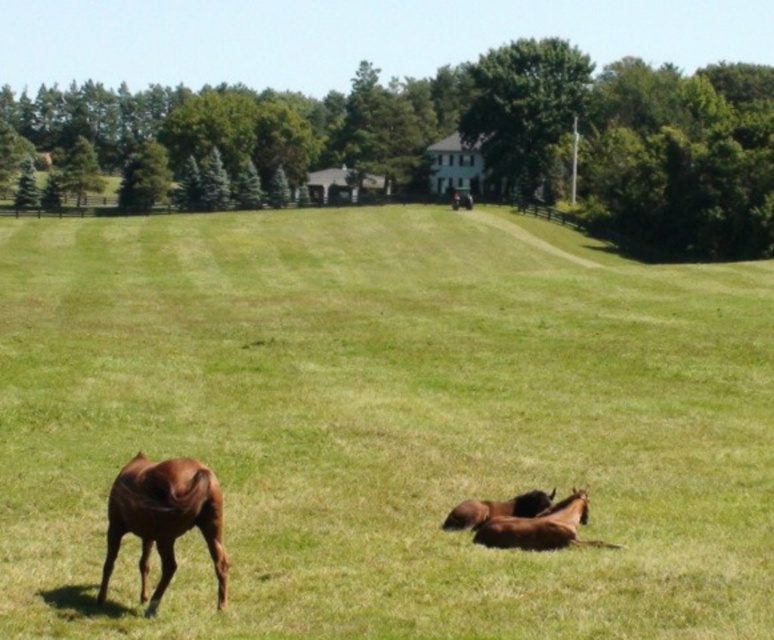
You are a photographer standing in the green grass pasture at center and want to take a photo of the brown glossy horse at lower right. Which object is closer to your camera lens?

The green grass pasture at center is closer to the viewer than the brown glossy horse at lower right, so the pasture will be in focus while the horse is slightly blurred.

You are a farmer who needs to determine if there is enough space to move the brown glossy horse at lower right to the green grass pasture at center. Based on the scene, can you confirm if the pasture is large enough to accommodate the horse?

The green grass pasture at center is bigger than the brown glossy horse at lower right, so yes, the pasture is large enough to accommodate the brown glossy horse at lower right.

You are a farmer who needs to move a new hay bale from the barn to the field. The barn is located behind the wooden fence. You want to place the hay bale so that it is equidistant between the brown glossy horse at lower left and the brown glossy horse at lower right. Is there enough space between them to place the hay bale?

The distance between the brown glossy horse at lower left and the brown glossy horse at lower right is 3.37 meters. To place the hay bale equidistant between them, the required space is at least 3.37 meters. Since the existing distance is exactly 3.37 meters, there is sufficient space to position the hay bale midway between the two horses.